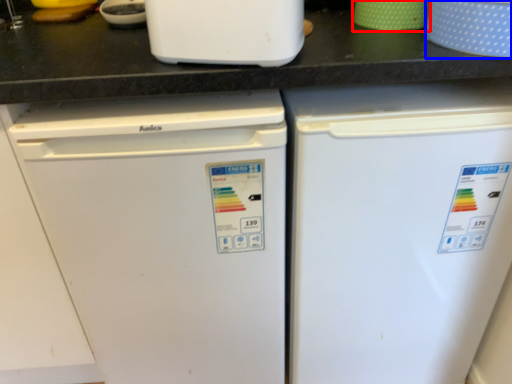
Question: Which object appears closest to the camera in this image, appliance (highlighted by a red box) or appliance (highlighted by a blue box)?

Choices:
 (A) appliance
 (B) appliance

Answer: (B)